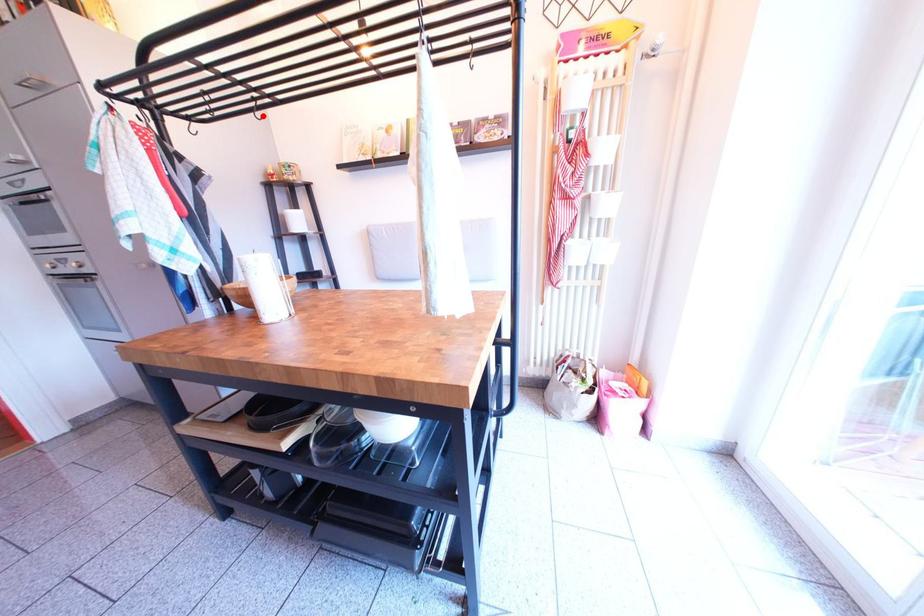
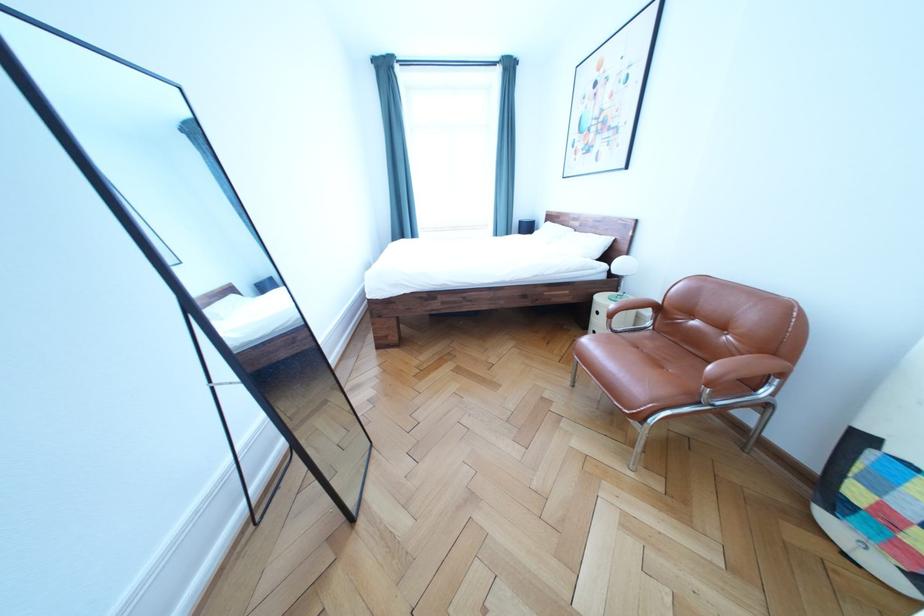
Question: I am providing you with two images of the same scene from different viewpoints. A red point is marked on the first image. Is the red point's position out of view in image 2?

Choices:
 (A) Yes
 (B) No

Answer: (A)